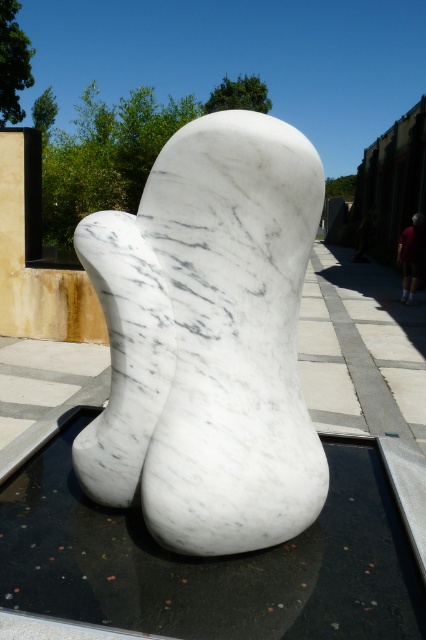
Is white marble sculpture at center positioned before dark blue jeans at right?

Yes.

Does white marble sculpture at center appear over dark blue jeans at right?

Actually, white marble sculpture at center is below dark blue jeans at right.

Which is behind, point (287, 516) or point (417, 241)?

Point (417, 241)

Where is `white marble sculpture at center`? The width and height of the screenshot is (426, 640). white marble sculpture at center is located at coordinates (209, 340).

Can you confirm if white marble water at center is positioned to the left of dark blue jeans at right?

Yes, white marble water at center is to the left of dark blue jeans at right.

Is white marble water at center to the right of dark blue jeans at right from the viewer's perspective?

No, white marble water at center is not to the right of dark blue jeans at right.

Which is behind, point (55, 480) or point (419, 214)?

Positioned behind is point (419, 214).

The image size is (426, 640). In order to click on white marble water at center in this screenshot , I will do `click(210, 561)`.

Where is `white marble sculpture at center`? The height and width of the screenshot is (640, 426). white marble sculpture at center is located at coordinates (209, 340).

Is point (310, 426) less distant than point (195, 561)?

No.

Identify the location of white marble sculpture at center. point(209,340).